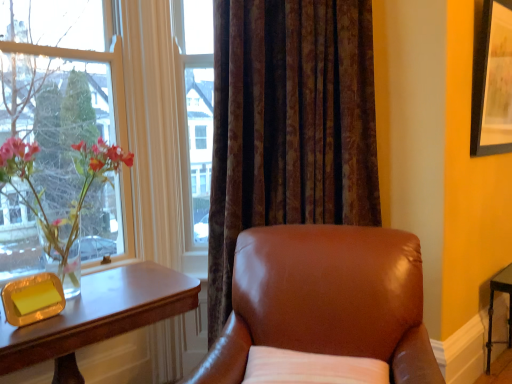
Question: Is wooden table at left at the right side of white fabric pillow at lower center?

Choices:
 (A) no
 (B) yes

Answer: (A)

Question: Is wooden table at left oriented towards white fabric pillow at lower center?

Choices:
 (A) yes
 (B) no

Answer: (A)

Question: Is the depth of wooden table at left greater than that of white fabric pillow at lower center?

Choices:
 (A) no
 (B) yes

Answer: (A)

Question: From a real-world perspective, is wooden table at left under white fabric pillow at lower center?

Choices:
 (A) yes
 (B) no

Answer: (A)

Question: Can you confirm if wooden table at left is shorter than white fabric pillow at lower center?

Choices:
 (A) no
 (B) yes

Answer: (A)

Question: Is wooden table at left smaller than white fabric pillow at lower center?

Choices:
 (A) yes
 (B) no

Answer: (B)

Question: Is white fabric pillow at lower center not within brown leather chair at center?

Choices:
 (A) yes
 (B) no

Answer: (B)

Question: Can you confirm if white fabric pillow at lower center is thinner than brown leather chair at center?

Choices:
 (A) no
 (B) yes

Answer: (B)

Question: From the image's perspective, does white fabric pillow at lower center appear lower than brown leather chair at center?

Choices:
 (A) yes
 (B) no

Answer: (A)

Question: From the image's perspective, is white fabric pillow at lower center on brown leather chair at center?

Choices:
 (A) yes
 (B) no

Answer: (B)

Question: From a real-world perspective, is white fabric pillow at lower center located higher than brown leather chair at center?

Choices:
 (A) yes
 (B) no

Answer: (B)

Question: Can you confirm if white fabric pillow at lower center is shorter than brown leather chair at center?

Choices:
 (A) yes
 (B) no

Answer: (A)

Question: Is the depth of translucent glass vase at left greater than that of wooden table at left?

Choices:
 (A) yes
 (B) no

Answer: (A)